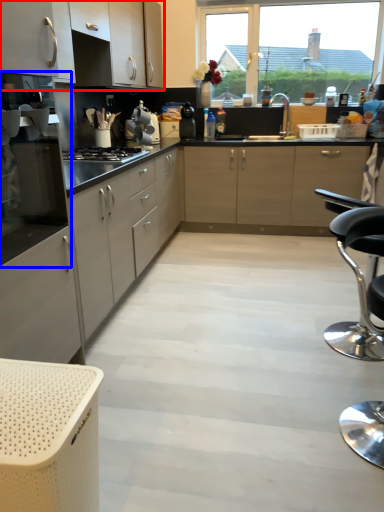
Question: Which object appears farthest to the camera in this image, cabinetry (highlighted by a red box) or oven (highlighted by a blue box)?

Choices:
 (A) cabinetry
 (B) oven

Answer: (A)